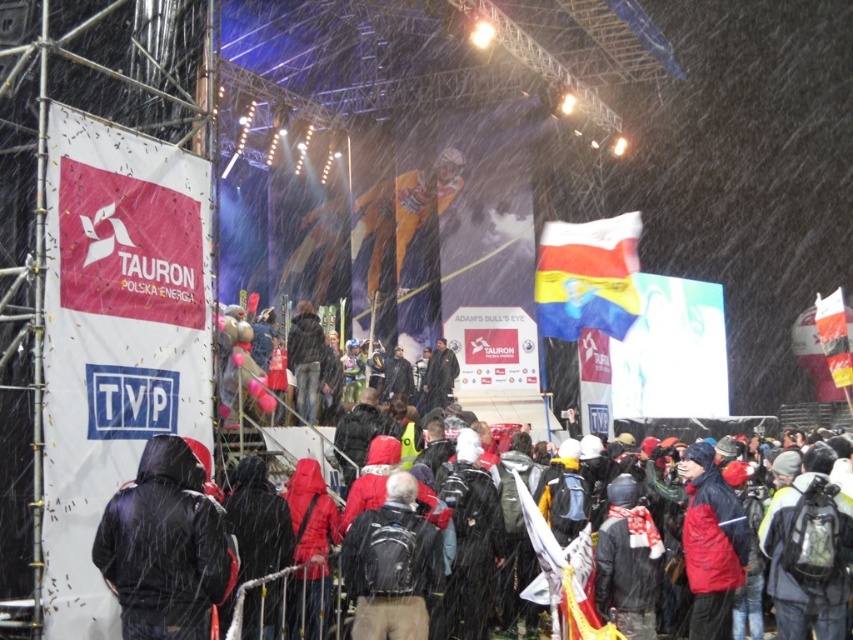
Question: Considering the relative positions of polished plastic flag at center and white fabric flag at right in the image provided, where is polished plastic flag at center located with respect to white fabric flag at right?

Choices:
 (A) right
 (B) left

Answer: (B)

Question: Is dark gray backpack at center closer to the viewer compared to dark blue jacket at center?

Choices:
 (A) no
 (B) yes

Answer: (A)

Question: Which of the following is the closest to the observer?

Choices:
 (A) (846, 348)
 (B) (613, 321)
 (C) (421, 589)

Answer: (C)

Question: From the image, what is the correct spatial relationship of black matte jacket at center in relation to dark gray backpack at center?

Choices:
 (A) below
 (B) above

Answer: (B)

Question: Among these points, which one is farthest from the camera?

Choices:
 (A) (396, 612)
 (B) (607, 266)
 (C) (676, 486)
 (D) (836, 314)

Answer: (D)

Question: Considering the real-world distances, which object is closest to the polished plastic flag at center?

Choices:
 (A) dark gray backpack at center
 (B) black matte jacket at center

Answer: (A)